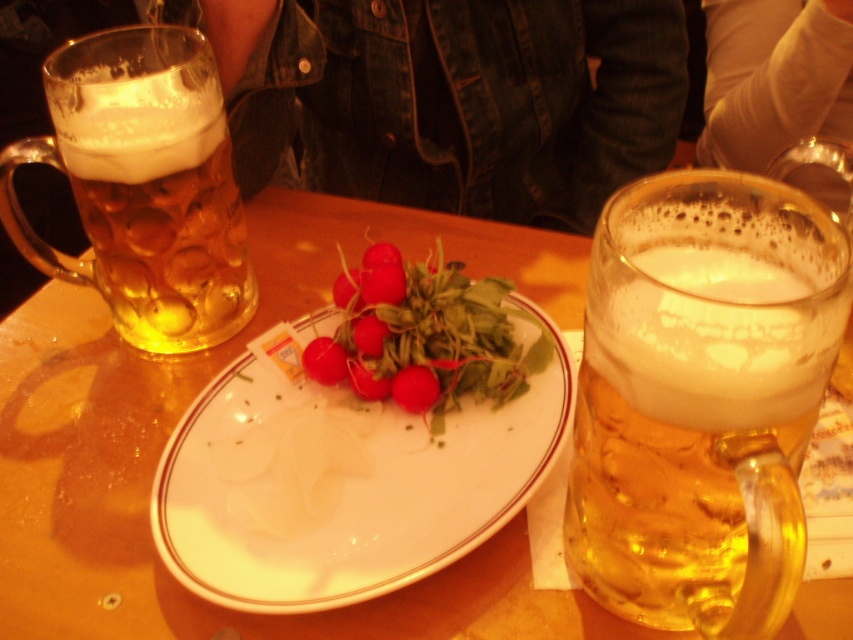
Question: Can you confirm if wooden table at center is positioned below red matte radish at center?

Choices:
 (A) yes
 (B) no

Answer: (A)

Question: Among these objects, which one is nearest to the camera?

Choices:
 (A) wooden table at center
 (B) translucent glass mug at left

Answer: (A)

Question: Which of these objects is positioned farthest from the white ceramic plate at center?

Choices:
 (A) translucent glass mug at center
 (B) translucent glass mug at left
 (C) wooden table at center

Answer: (B)

Question: Which point is closer to the camera taking this photo?

Choices:
 (A) (691, 179)
 (B) (161, 72)
 (C) (212, 353)
 (D) (346, 422)

Answer: (A)

Question: Can you confirm if wooden table at center is positioned below red matte radish at center?

Choices:
 (A) yes
 (B) no

Answer: (A)

Question: Does wooden table at center lie behind red matte radish at center?

Choices:
 (A) no
 (B) yes

Answer: (A)